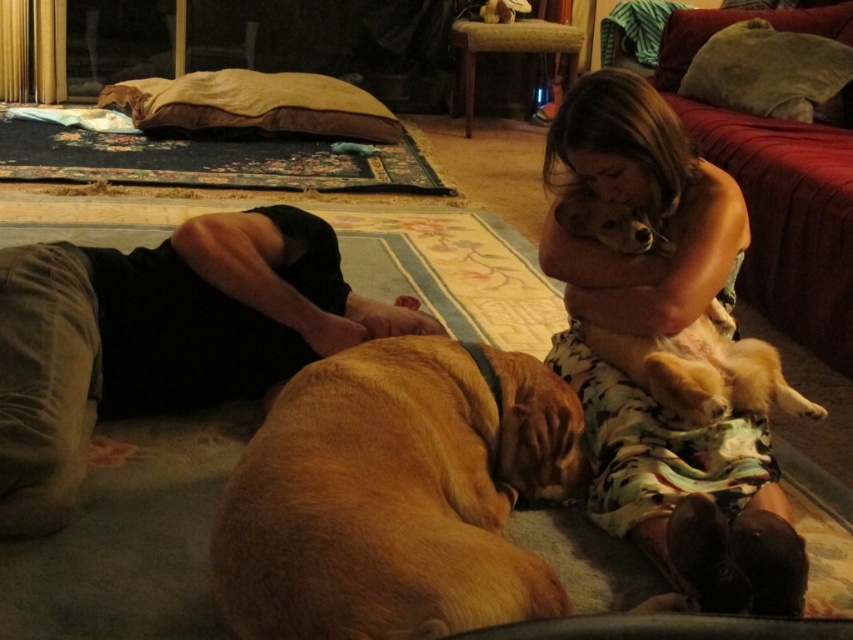
Where is the golden fur dog at center located in the image?

The golden fur dog at center is located at the 2D coordinates point (396, 493) in the image.

You are trying to decide whether to place a new rectangular coffee table in the living room. The table is 1.2 meters wide. You see the fluffy brown dog at upper right and the dark brown cotton pants at lower left. Which object is narrower, and can the table fit between them if they are positioned side by side?

The fluffy brown dog at upper right is narrower than the dark brown cotton pants at lower left. Since the table is 1.2 meters wide, and the combined width of the two objects is less than 1.2 meters, the table can fit between them when placed side by side.

You are trying to decide whether the golden fur dog at center can jump over the dark brown cotton pants at lower left. Based on their heights, can it do so?

The golden fur dog at center is shorter than the dark brown cotton pants at lower left. Since the dog is shorter, it might struggle to jump over the pants unless it has exceptional jumping ability.